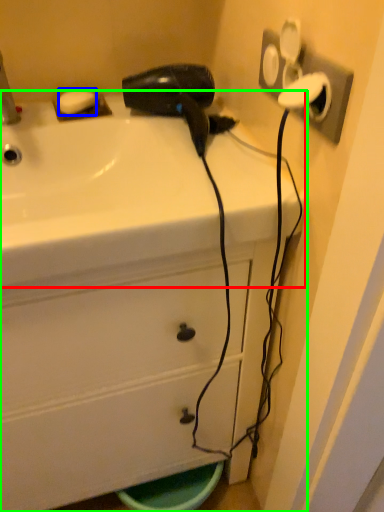
Question: Based on their relative distances, which object is farther from sink (highlighted by a red box)? Choose from soap (highlighted by a blue box) and bathroom cabinet (highlighted by a green box).

Choices:
 (A) soap
 (B) bathroom cabinet

Answer: (A)